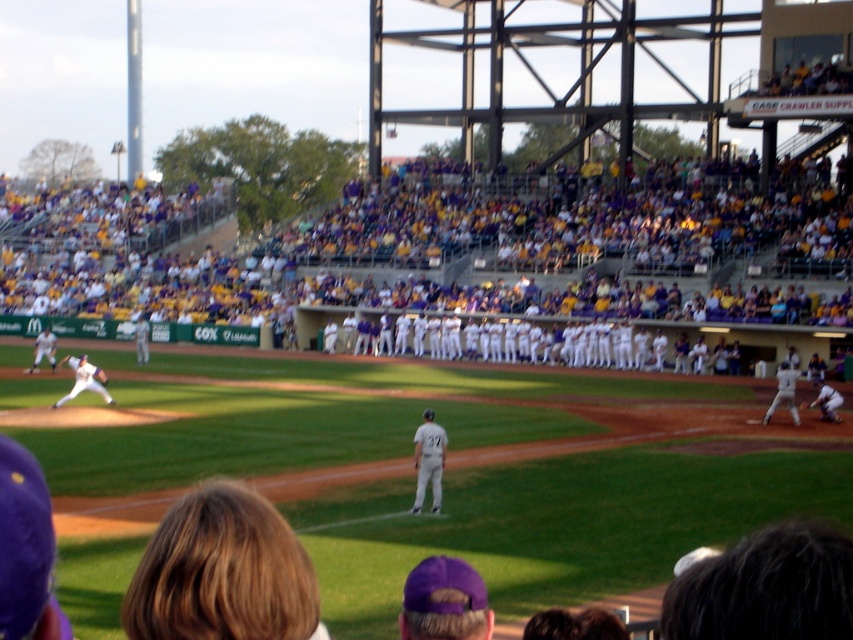
Can you confirm if white uniform at center is thinner than white uniformed pitcher at left?

Yes.

In the scene shown: Can you confirm if white uniform at center is taller than white uniformed pitcher at left?

Yes.

Who is more forward, (x=419, y=486) or (x=64, y=401)?

Positioned in front is point (x=419, y=486).

At what (x,y) coordinates should I click in order to perform the action: click on white uniform at center. Please return your answer as a coordinate pair (x, y). The width and height of the screenshot is (853, 640). Looking at the image, I should click on (428, 460).

Between white uniform at center and white uniform at right, which one is positioned lower?

white uniform at center is lower down.

Can you confirm if white uniform at center is wider than white uniform at right?

In fact, white uniform at center might be narrower than white uniform at right.

In order to click on white uniform at center in this screenshot , I will do `click(428, 460)`.

Which is more to the right, white uniform at right or brown leather glove at lower right?

From the viewer's perspective, white uniform at right appears more on the right side.

Does white uniform at right have a greater height compared to brown leather glove at lower right?

Indeed, white uniform at right has a greater height compared to brown leather glove at lower right.

At what (x,y) coordinates should I click in order to perform the action: click on white uniform at right. Please return your answer as a coordinate pair (x, y). This screenshot has height=640, width=853. Looking at the image, I should click on (825, 401).